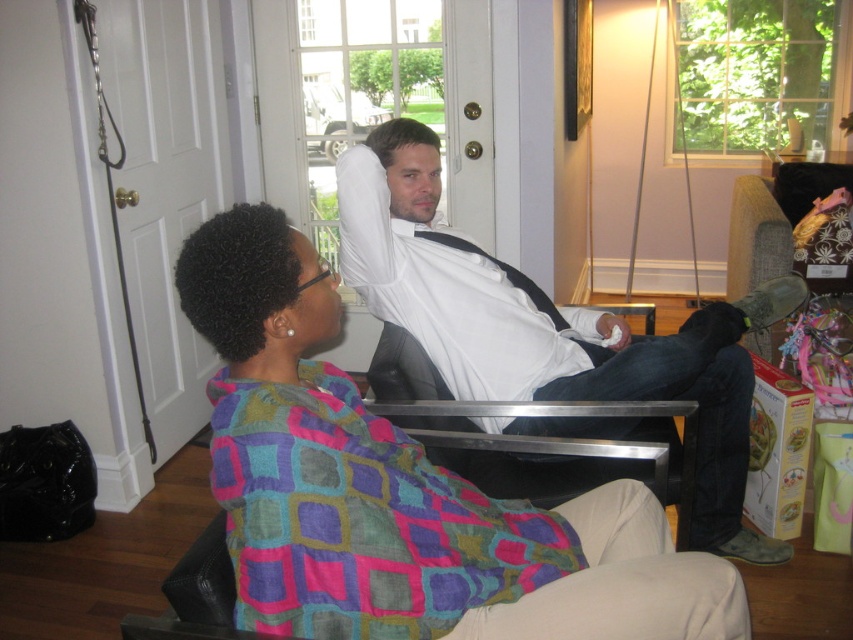
Question: Does multicolored fabric at center appear under white cotton shirt at center?

Choices:
 (A) no
 (B) yes

Answer: (B)

Question: Which of the following is the farthest from the observer?

Choices:
 (A) multicolored fabric at center
 (B) white cotton shirt at center

Answer: (B)

Question: Is multicolored fabric at center above white cotton shirt at center?

Choices:
 (A) no
 (B) yes

Answer: (A)

Question: Is multicolored fabric at center positioned before white cotton shirt at center?

Choices:
 (A) yes
 (B) no

Answer: (A)

Question: Among these points, which one is farthest from the camera?

Choices:
 (A) (503, 420)
 (B) (575, 632)

Answer: (A)